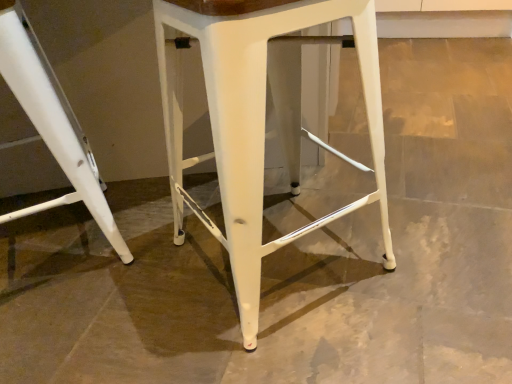
I want to click on white matte stool at left, positioned as the first stool in left-to-right order, so click(51, 127).

Describe the element at coordinates (51, 127) in the screenshot. This screenshot has width=512, height=384. I see `white matte stool at left, positioned as the first stool in left-to-right order` at that location.

Where is `white metal stool at center, the second stool viewed from the left`? white metal stool at center, the second stool viewed from the left is located at coordinates (255, 125).

Image resolution: width=512 pixels, height=384 pixels. What do you see at coordinates (255, 125) in the screenshot?
I see `white metal stool at center, the second stool viewed from the left` at bounding box center [255, 125].

What is the approximate width of white metal stool at center, which is counted as the first stool, starting from the right?

15.95 inches.

This screenshot has width=512, height=384. In order to click on white matte stool at left, positioned as the first stool in left-to-right order in this screenshot , I will do `click(51, 127)`.

Is white metal stool at center, which is counted as the first stool, starting from the right, to the left of white matte stool at left, the 2th stool when ordered from right to left, from the viewer's perspective?

No.

Which object is further away from the camera, white metal stool at center, the second stool viewed from the left, or white matte stool at left, positioned as the first stool in left-to-right order?

white matte stool at left, positioned as the first stool in left-to-right order, is further away from the camera.

Is point (245, 149) positioned in front of point (21, 41)?

Yes, it is in front of point (21, 41).

From the image's perspective, would you say white metal stool at center, which is counted as the first stool, starting from the right, is positioned over white matte stool at left, the 2th stool when ordered from right to left?

Incorrect, from the image's perspective, white metal stool at center, which is counted as the first stool, starting from the right, is lower than white matte stool at left, the 2th stool when ordered from right to left.

From a real-world perspective, between white metal stool at center, which is counted as the first stool, starting from the right, and white matte stool at left, the 2th stool when ordered from right to left, who is vertically higher?

In real-world perspective, white metal stool at center, which is counted as the first stool, starting from the right, is above.

Is white metal stool at center, the second stool viewed from the left, wider or thinner than white matte stool at left, positioned as the first stool in left-to-right order?

In the image, white metal stool at center, the second stool viewed from the left, appears to be more narrow than white matte stool at left, positioned as the first stool in left-to-right order.

Can you confirm if white metal stool at center, the second stool viewed from the left, is taller than white matte stool at left, positioned as the first stool in left-to-right order?

Correct, white metal stool at center, the second stool viewed from the left, is much taller as white matte stool at left, positioned as the first stool in left-to-right order.

From the picture: Does white metal stool at center, the second stool viewed from the left, have a smaller size compared to white matte stool at left, positioned as the first stool in left-to-right order?

Incorrect, white metal stool at center, the second stool viewed from the left, is not smaller in size than white matte stool at left, positioned as the first stool in left-to-right order.

Is white matte stool at left, positioned as the first stool in left-to-right order, surrounded by white metal stool at center, the second stool viewed from the left?

That's incorrect, white matte stool at left, positioned as the first stool in left-to-right order, is not inside white metal stool at center, the second stool viewed from the left.

Can you see white metal stool at center, the second stool viewed from the left, touching white matte stool at left, positioned as the first stool in left-to-right order?

No, white metal stool at center, the second stool viewed from the left, is not making contact with white matte stool at left, positioned as the first stool in left-to-right order.

Is white matte stool at left, positioned as the first stool in left-to-right order, at the back of white metal stool at center, which is counted as the first stool, starting from the right?

No.

What's the angular difference between white metal stool at center, the second stool viewed from the left, and white matte stool at left, the 2th stool when ordered from right to left,'s facing directions?

6.12 degrees separate the facing orientations of white metal stool at center, the second stool viewed from the left, and white matte stool at left, the 2th stool when ordered from right to left.

How far apart are white metal stool at center, the second stool viewed from the left, and white matte stool at left, positioned as the first stool in left-to-right order?

white metal stool at center, the second stool viewed from the left, is 34.79 centimeters from white matte stool at left, positioned as the first stool in left-to-right order.

At what (x,y) coordinates should I click in order to perform the action: click on stool that is above the white metal stool at center, which is counted as the first stool, starting from the right (from the image's perspective). Please return your answer as a coordinate pair (x, y). Image resolution: width=512 pixels, height=384 pixels. Looking at the image, I should click on (51, 127).

Is white matte stool at left, the 2th stool when ordered from right to left, to the left of white metal stool at center, which is counted as the first stool, starting from the right, from the viewer's perspective?

Yes, white matte stool at left, the 2th stool when ordered from right to left, is to the left of white metal stool at center, which is counted as the first stool, starting from the right.

Which is behind, white matte stool at left, the 2th stool when ordered from right to left, or white metal stool at center, which is counted as the first stool, starting from the right?

Positioned behind is white matte stool at left, the 2th stool when ordered from right to left.

Is point (24, 35) closer or farther from the camera than point (218, 235)?

Point (24, 35) appears to be farther away from the viewer than point (218, 235).

From the image's perspective, which is below, white matte stool at left, the 2th stool when ordered from right to left, or white metal stool at center, the second stool viewed from the left?

white metal stool at center, the second stool viewed from the left, from the image's perspective.

From a real-world perspective, which is physically below, white matte stool at left, positioned as the first stool in left-to-right order, or white metal stool at center, which is counted as the first stool, starting from the right?

white matte stool at left, positioned as the first stool in left-to-right order.

From the picture: Which object is wider, white matte stool at left, positioned as the first stool in left-to-right order, or white metal stool at center, the second stool viewed from the left?

Wider between the two is white matte stool at left, positioned as the first stool in left-to-right order.

Can you confirm if white matte stool at left, the 2th stool when ordered from right to left, is taller than white metal stool at center, the second stool viewed from the left?

No.

Does white matte stool at left, positioned as the first stool in left-to-right order, have a larger size compared to white metal stool at center, which is counted as the first stool, starting from the right?

No.

Is white matte stool at left, positioned as the first stool in left-to-right order, inside or outside of white metal stool at center, which is counted as the first stool, starting from the right?

white matte stool at left, positioned as the first stool in left-to-right order, cannot be found inside white metal stool at center, which is counted as the first stool, starting from the right.

In the scene shown: Are white matte stool at left, positioned as the first stool in left-to-right order, and white metal stool at center, which is counted as the first stool, starting from the right, located far from each other?

No, white matte stool at left, positioned as the first stool in left-to-right order, is not far away from white metal stool at center, which is counted as the first stool, starting from the right.

Is white matte stool at left, the 2th stool when ordered from right to left, looking in the opposite direction of white metal stool at center, which is counted as the first stool, starting from the right?

No, white matte stool at left, the 2th stool when ordered from right to left,'s orientation is not away from white metal stool at center, which is counted as the first stool, starting from the right.

Measure the distance between white matte stool at left, positioned as the first stool in left-to-right order, and white metal stool at center, the second stool viewed from the left.

A distance of 13.70 inches exists between white matte stool at left, positioned as the first stool in left-to-right order, and white metal stool at center, the second stool viewed from the left.

This screenshot has height=384, width=512. I want to click on stool that is above the white metal stool at center, which is counted as the first stool, starting from the right (from the image's perspective), so click(x=51, y=127).

At what (x,y) coordinates should I click in order to perform the action: click on stool on the left of the white metal stool at center, the second stool viewed from the left. Please return your answer as a coordinate pair (x, y). Looking at the image, I should click on (51, 127).

The image size is (512, 384). I want to click on stool on the right of white matte stool at left, the 2th stool when ordered from right to left, so click(x=255, y=125).